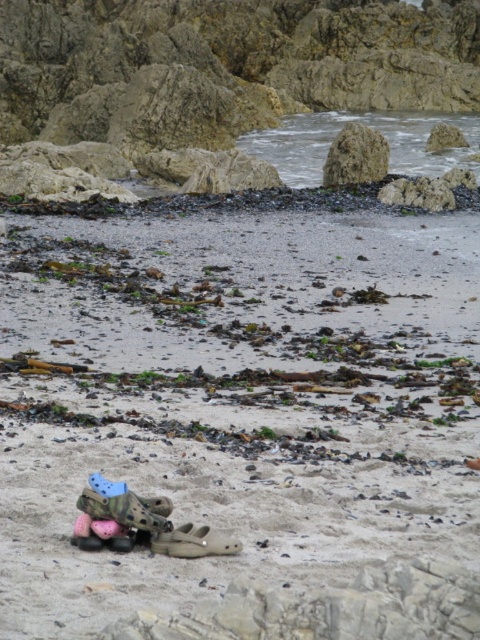
Question: Estimate the real-world distances between objects in this image. Which object is farther from the tan suede shoe at center?

Choices:
 (A) brown rough rock at upper center
 (B) crocodile-patterned rubber sandal at lower center

Answer: (A)

Question: Which point is farther to the camera?

Choices:
 (A) crocodile-patterned rubber sandal at lower center
 (B) tan suede shoe at center
 (C) brown sandy beach at center
 (D) brown rough rock at upper center

Answer: (D)

Question: Does brown sandy beach at center have a larger size compared to brown rough rock at upper center?

Choices:
 (A) no
 (B) yes

Answer: (B)

Question: Estimate the real-world distances between objects in this image. Which object is farther from the crocodile-patterned rubber sandal at lower center?

Choices:
 (A) tan suede shoe at center
 (B) brown sandy beach at center

Answer: (B)

Question: Is brown sandy beach at center wider than tan suede shoe at center?

Choices:
 (A) yes
 (B) no

Answer: (A)

Question: Can you confirm if brown sandy beach at center is positioned to the left of tan suede shoe at center?

Choices:
 (A) yes
 (B) no

Answer: (B)